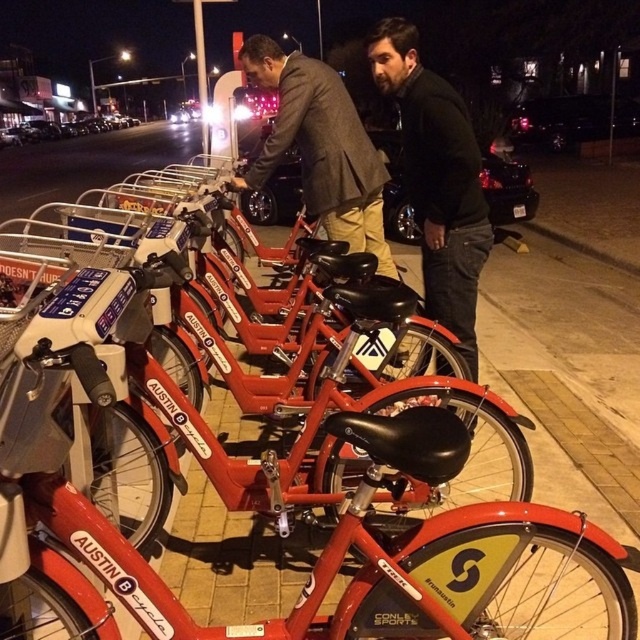
Question: Does matte black jacket at center have a greater width compared to matte gray suit at center?

Choices:
 (A) yes
 (B) no

Answer: (A)

Question: Which point is farther to the camera?

Choices:
 (A) (305, 88)
 (B) (448, 132)

Answer: (A)

Question: Which of the following is the farthest from the observer?

Choices:
 (A) (289, 104)
 (B) (468, 212)
 (C) (424, 269)
 (D) (42, 497)

Answer: (A)

Question: Is matte black jacket at center above matte gray suit at center?

Choices:
 (A) yes
 (B) no

Answer: (B)

Question: Among these objects, which one is nearest to the camera?

Choices:
 (A) matte gray suit at center
 (B) dark brown leather jacket at center
 (C) matte red bicycle at center
 (D) matte black jacket at center

Answer: (C)

Question: Does matte black jacket at center appear on the right side of dark brown leather jacket at center?

Choices:
 (A) no
 (B) yes

Answer: (A)